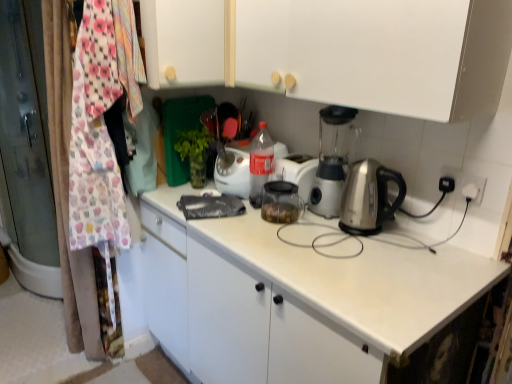
Question: Does white matte cabinet at upper center, positioned as the 1th cabinetry in left-to-right order, have a smaller size compared to translucent plastic bottle at center?

Choices:
 (A) no
 (B) yes

Answer: (A)

Question: Is white matte cabinet at upper center, positioned as the 2th cabinetry in right-to-left order, positioned with its back to translucent plastic bottle at center?

Choices:
 (A) no
 (B) yes

Answer: (A)

Question: Is white matte cabinet at upper center, positioned as the 2th cabinetry in right-to-left order, at the right side of translucent plastic bottle at center?

Choices:
 (A) yes
 (B) no

Answer: (B)

Question: Can you confirm if white matte cabinet at upper center, positioned as the 2th cabinetry in right-to-left order, is wider than translucent plastic bottle at center?

Choices:
 (A) no
 (B) yes

Answer: (B)

Question: Is translucent plastic bottle at center a part of white matte cabinet at upper center, positioned as the 1th cabinetry in left-to-right order?

Choices:
 (A) no
 (B) yes

Answer: (A)

Question: Considering their positions, is white matte cabinet at upper center, positioned as the 2th cabinetry in left-to-right order, located in front of or behind translucent plastic bottle at center?

Choices:
 (A) front
 (B) behind

Answer: (A)

Question: In terms of height, does white matte cabinet at upper center, placed as the 1th cabinetry when sorted from right to left, look taller or shorter compared to translucent plastic bottle at center?

Choices:
 (A) tall
 (B) short

Answer: (A)

Question: From a real-world perspective, relative to translucent plastic bottle at center, is white matte cabinet at upper center, placed as the 1th cabinetry when sorted from right to left, vertically above or below?

Choices:
 (A) above
 (B) below

Answer: (A)

Question: Looking at the image, does white matte cabinet at upper center, positioned as the 2th cabinetry in left-to-right order, seem bigger or smaller compared to translucent plastic bottle at center?

Choices:
 (A) small
 (B) big

Answer: (B)

Question: Is white matte cabinet at upper center, positioned as the 2th cabinetry in right-to-left order, taller or shorter than white matte cabinet at upper center, placed as the 1th cabinetry when sorted from right to left?

Choices:
 (A) tall
 (B) short

Answer: (A)

Question: From the image's perspective, relative to white matte cabinet at upper center, positioned as the 2th cabinetry in left-to-right order, is white matte cabinet at upper center, positioned as the 1th cabinetry in left-to-right order, above or below?

Choices:
 (A) below
 (B) above

Answer: (B)

Question: From a real-world perspective, is white matte cabinet at upper center, positioned as the 1th cabinetry in left-to-right order, positioned above or below white matte cabinet at upper center, positioned as the 2th cabinetry in left-to-right order?

Choices:
 (A) above
 (B) below

Answer: (A)

Question: Based on their sizes in the image, would you say white matte cabinet at upper center, positioned as the 1th cabinetry in left-to-right order, is bigger or smaller than white matte cabinet at upper center, positioned as the 2th cabinetry in left-to-right order?

Choices:
 (A) big
 (B) small

Answer: (B)

Question: From a real-world perspective, relative to white matte cabinet at upper center, positioned as the 1th cabinetry in left-to-right order, is white matte cabinet at upper center, positioned as the 2th cabinetry in left-to-right order, vertically above or below?

Choices:
 (A) below
 (B) above

Answer: (A)

Question: Considering their positions, is white matte cabinet at upper center, positioned as the 2th cabinetry in left-to-right order, located in front of or behind white matte cabinet at upper center, positioned as the 1th cabinetry in left-to-right order?

Choices:
 (A) front
 (B) behind

Answer: (A)